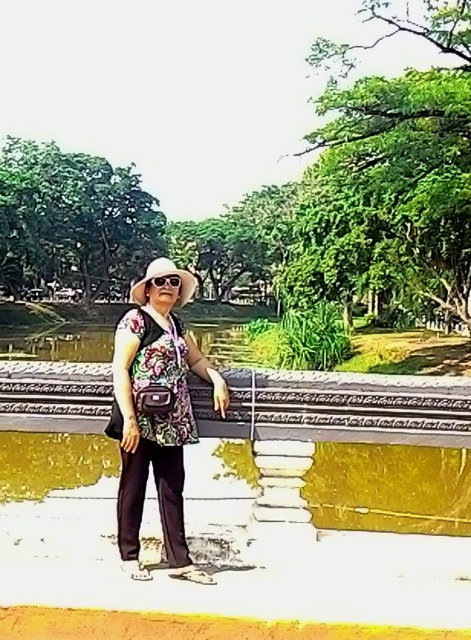
Is floral fabric blouse at center to the left of sunglasses at center from the viewer's perspective?

Yes, floral fabric blouse at center is to the left of sunglasses at center.

Does floral fabric blouse at center appear under sunglasses at center?

Yes.

Is point (121, 403) more distant than point (161, 275)?

No.

Find the location of a particular element. The height and width of the screenshot is (640, 471). floral fabric blouse at center is located at coordinates (156, 416).

Is metallic polished rail at center behind sunglasses at center?

Yes, metallic polished rail at center is further from the viewer.

Does metallic polished rail at center come in front of sunglasses at center?

That is False.

Who is more forward, (270, 420) or (164, 282)?

Positioned in front is point (164, 282).

This screenshot has height=640, width=471. I want to click on metallic polished rail at center, so click(x=349, y=401).

Can you confirm if floral fabric blouse at center is shorter than metallic polished rail at center?

No, floral fabric blouse at center is not shorter than metallic polished rail at center.

Can you confirm if floral fabric blouse at center is smaller than metallic polished rail at center?

No.

Does point (129, 506) lie behind point (445, 422)?

That is False.

Where is `floral fabric blouse at center`? This screenshot has height=640, width=471. floral fabric blouse at center is located at coordinates (156, 416).